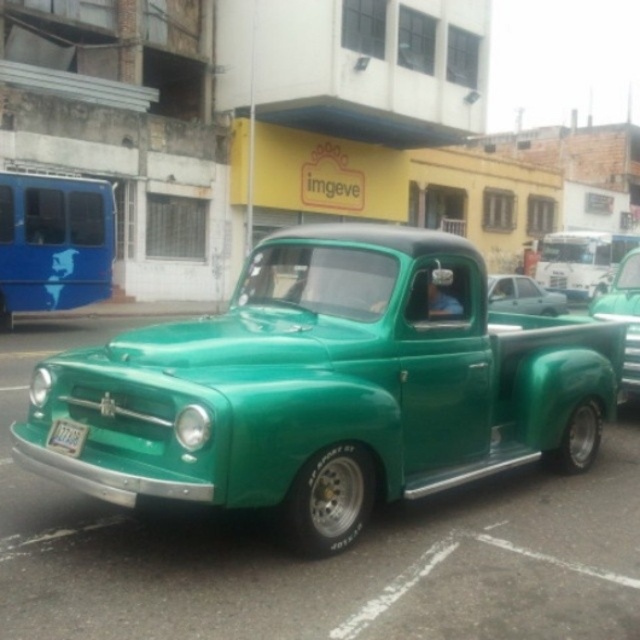
This screenshot has height=640, width=640. I want to click on metallic green truck at center, so click(x=321, y=561).

Which is behind, point (227, 605) or point (84, 438)?

Positioned behind is point (84, 438).

Is point (506, 472) behind point (65, 452)?

Yes.

Find the location of a particular element. The image size is (640, 640). metallic green truck at center is located at coordinates (321, 561).

How much distance is there between metallic green truck at center and matte green pickup truck at center?

metallic green truck at center and matte green pickup truck at center are 6.36 meters apart.

Which is more to the right, metallic green truck at center or matte green pickup truck at center?

matte green pickup truck at center

Who is more forward, (84, 499) or (513, 278)?

Positioned in front is point (84, 499).

At what (x,y) coordinates should I click in order to perform the action: click on metallic green truck at center. Please return your answer as a coordinate pair (x, y). This screenshot has width=640, height=640. Looking at the image, I should click on (321, 561).

Is green matte truck at left further to the viewer compared to green matte license plate at front?

Yes, green matte truck at left is further from the viewer.

The width and height of the screenshot is (640, 640). What are the coordinates of `green matte truck at left` in the screenshot? It's located at (52, 243).

In order to click on green matte truck at left in this screenshot , I will do `click(52, 243)`.